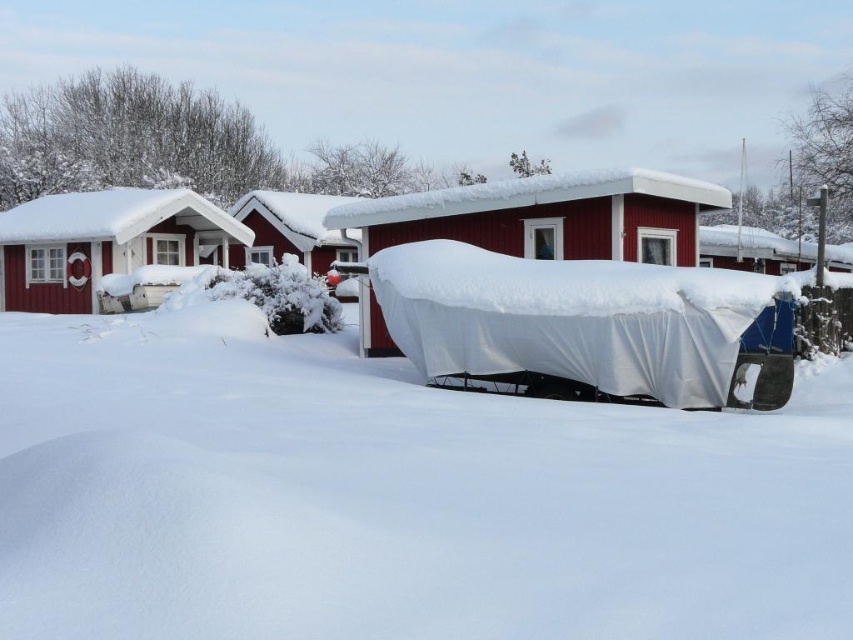
Does matte red boat at center have a lesser width compared to matte red wooden hut at left?

Correct, matte red boat at center's width is less than matte red wooden hut at left's.

Does point (442, 227) come farther from viewer compared to point (190, 236)?

No, it is in front of (190, 236).

Locate an element on the screen. matte red boat at center is located at coordinates (548, 216).

Who is positioned more to the left, matte red wooden hut at left or white plastic boat at right?

matte red wooden hut at left

Who is more distant from viewer, (183, 241) or (766, 248)?

The point (183, 241) is behind.

Locate an element on the screen. The width and height of the screenshot is (853, 640). matte red wooden hut at left is located at coordinates (103, 243).

Which is below, matte red boat at center or white plastic boat at right?

matte red boat at center is below.

Who is higher up, matte red boat at center or white plastic boat at right?

white plastic boat at right

This screenshot has height=640, width=853. Find the location of `matte red boat at center`. matte red boat at center is located at coordinates (548, 216).